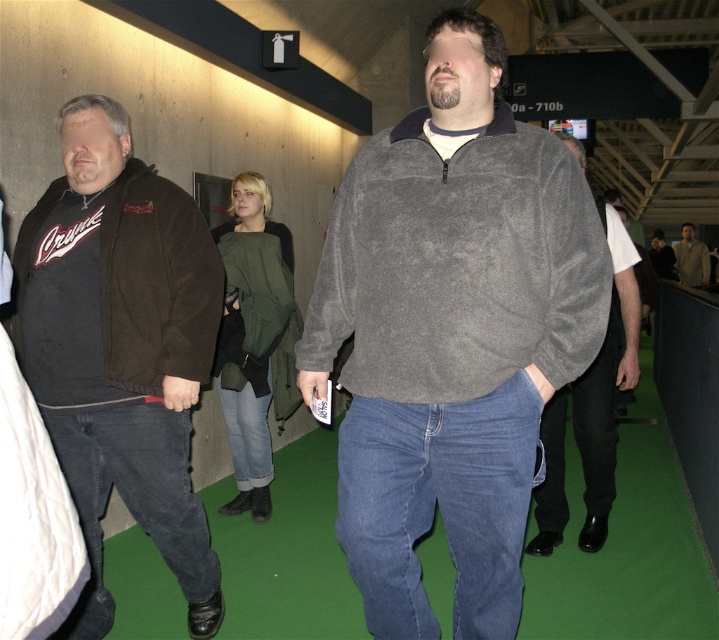
Who is taller, gray suede sweater at center or dark brown fleece sweatshirt at left?

With more height is gray suede sweater at center.

Which is behind, point (338, 326) or point (206, 288)?

Positioned behind is point (206, 288).

This screenshot has width=719, height=640. Find the location of `gray suede sweater at center`. gray suede sweater at center is located at coordinates (452, 333).

From the picture: Between gray suede sweater at center and jeans at center, which one appears on the left side from the viewer's perspective?

jeans at center

Who is more distant from viewer, (462,298) or (262,435)?

Point (262,435)

Is point (477, 365) positioned before point (233, 458)?

That is True.

Locate an element on the screen. gray suede sweater at center is located at coordinates (452, 333).

Can you confirm if dark blue corduroy jeans at lower left is positioned below blue denim jeans at lower center?

Yes.

Which is above, dark blue corduroy jeans at lower left or blue denim jeans at lower center?

blue denim jeans at lower center is above.

Is point (162, 449) more distant than point (595, 515)?

No, it is not.

The image size is (719, 640). I want to click on dark blue corduroy jeans at lower left, so click(137, 502).